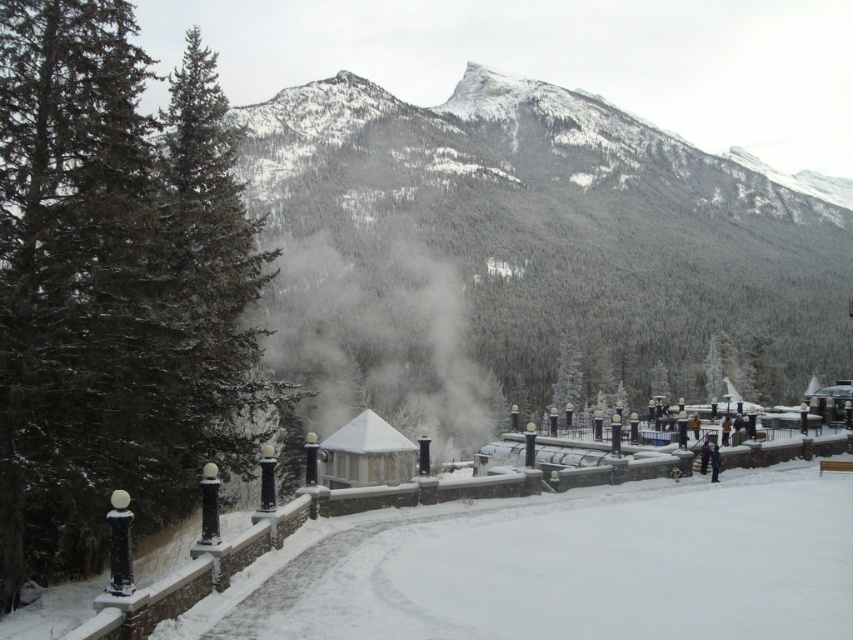
Is green matte tree at left positioned before snowy forested mountain at upper center?

Yes, it is in front of snowy forested mountain at upper center.

From the picture: Between green matte tree at left and snowy forested mountain at upper center, which one is positioned higher?

snowy forested mountain at upper center is above.

Is point (129, 396) closer to camera compared to point (767, 228)?

Yes, it is in front of point (767, 228).

What are the coordinates of `green matte tree at left` in the screenshot? It's located at (113, 285).

Who is lower down, snowy forested mountain at upper center or white foggy steam at center?

white foggy steam at center is lower down.

Is snowy forested mountain at upper center positioned behind white foggy steam at center?

Yes, it is.

Is point (679, 321) closer to camera compared to point (415, 145)?

Yes, point (679, 321) is closer to viewer.

You are a GUI agent. You are given a task and a screenshot of the screen. Output one action in this format:
    pyautogui.click(x=<x>, y=<y>)
    Task: Click on the snowy forested mountain at upper center
    The image size is (853, 640).
    Given the screenshot: What is the action you would take?
    pos(560,220)

Is green matte tree at left taller than white foggy steam at center?

No.

What do you see at coordinates (113, 285) in the screenshot? The image size is (853, 640). I see `green matte tree at left` at bounding box center [113, 285].

Does point (35, 378) come closer to viewer compared to point (387, 276)?

Yes.

The width and height of the screenshot is (853, 640). I want to click on green matte tree at left, so click(x=113, y=285).